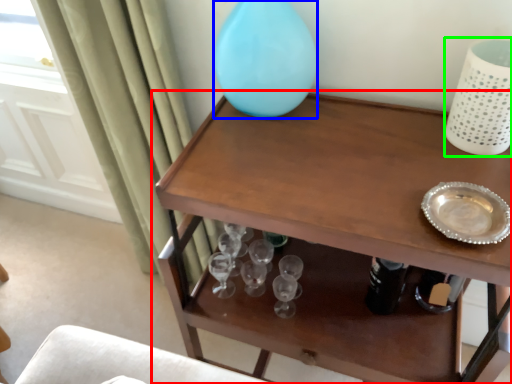
Question: Estimate the real-world distances between objects in this image. Which object is closer to table (highlighted by a red box), vase (highlighted by a blue box) or vase (highlighted by a green box)?

Choices:
 (A) vase
 (B) vase

Answer: (A)